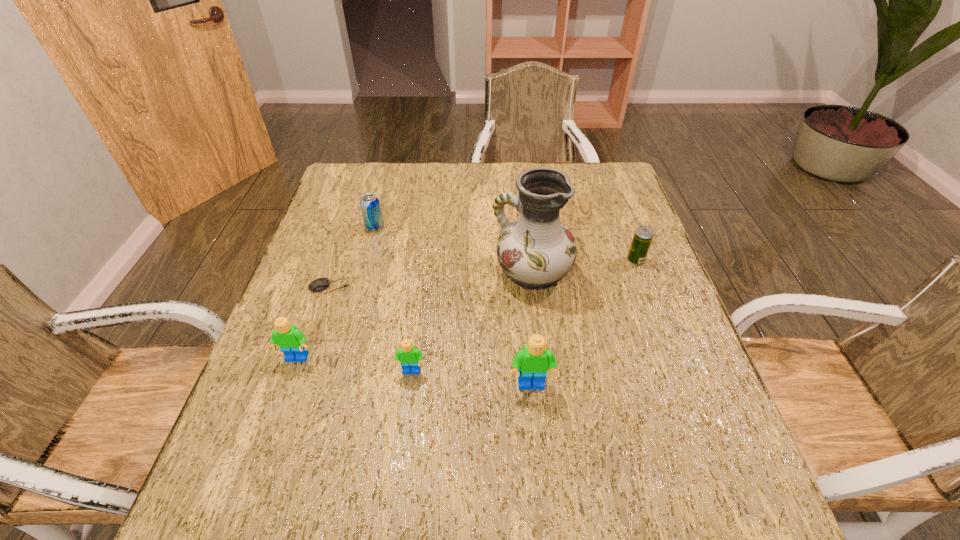
The height and width of the screenshot is (540, 960). What are the coordinates of `free spot between the mouse and the farther beer can` in the screenshot? It's located at (352, 256).

Find the location of a particular element. vacant space that is in between the vase and the right beer can is located at coordinates (584, 266).

The image size is (960, 540). Identify the location of empty space between the mouse and the fifth shortest object. (313, 322).

Locate an element on the screen. This screenshot has height=540, width=960. free space between the nearer beer can and the leftmost Lego is located at coordinates pyautogui.click(x=467, y=309).

Where is `free spot between the leftmost Lego and the right beer can`? Image resolution: width=960 pixels, height=540 pixels. free spot between the leftmost Lego and the right beer can is located at coordinates (467, 309).

You are a GUI agent. You are given a task and a screenshot of the screen. Output one action in this format:
    pyautogui.click(x=<x>, y=<y>)
    Task: Click on the vacant area between the second tallest object and the right beer can
    
    Given the screenshot: What is the action you would take?
    pyautogui.click(x=584, y=323)

Find the location of a particular element. Image resolution: width=960 pixels, height=540 pixels. free spot between the second Lego from left to right and the leftmost Lego is located at coordinates (354, 365).

Image resolution: width=960 pixels, height=540 pixels. Identify the location of free space between the tallest object and the shortest object. (431, 279).

Locate which object is the second closest to the nearer beer can. Please provide its 2D coordinates. Your answer should be formatted as a tuple, i.e. [(x, y)], where the tuple contains the x and y coordinates of a point satisfying the conditions above.

[(533, 362)]

Where is `the third closest object relative to the vase`? This screenshot has height=540, width=960. the third closest object relative to the vase is located at coordinates (410, 357).